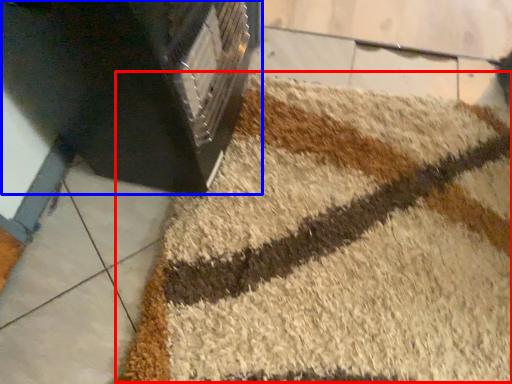
Question: Which of the following is the closest to the observer, bath mat (highlighted by a red box) or furniture (highlighted by a blue box)?

Choices:
 (A) bath mat
 (B) furniture

Answer: (B)